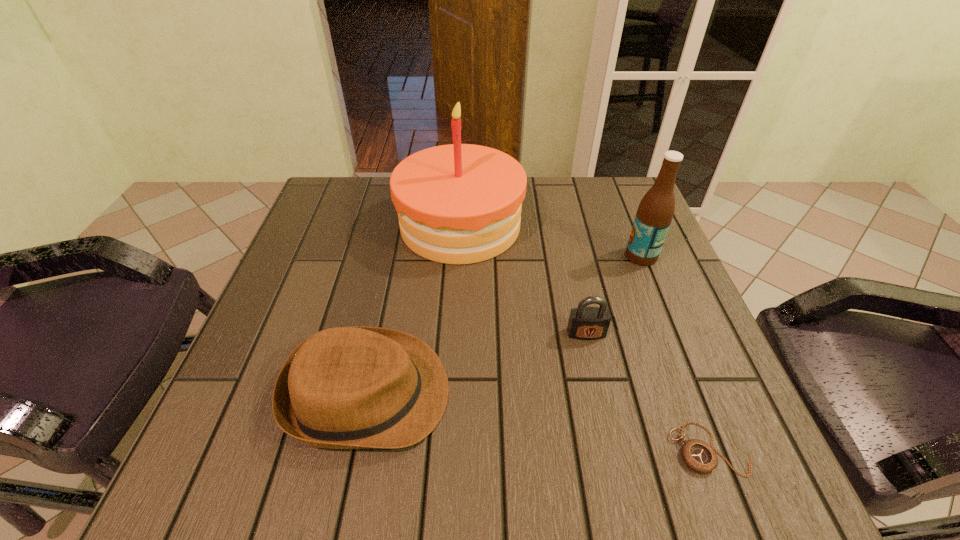
Identify the location of vacant area that lies between the tallest object and the fedora. The image size is (960, 540). pyautogui.click(x=414, y=309).

Where is `free space between the third object from left to right and the fedora`? free space between the third object from left to right and the fedora is located at coordinates (477, 363).

Where is `blank region between the second tallest object and the tallest object`? The width and height of the screenshot is (960, 540). blank region between the second tallest object and the tallest object is located at coordinates (551, 240).

Locate an element on the screen. The image size is (960, 540). vacant space that's between the birthday cake and the padlock is located at coordinates (523, 279).

Locate which object ranks fourth in proximity to the second tallest object. Please provide its 2D coordinates. Your answer should be formatted as a tuple, i.e. [(x, y)], where the tuple contains the x and y coordinates of a point satisfying the conditions above.

[(346, 387)]

Image resolution: width=960 pixels, height=540 pixels. Identify the location of object that is the closest to the fedora. (459, 203).

Image resolution: width=960 pixels, height=540 pixels. I want to click on free region that satisfies the following two spatial constraints: 1. on the front-facing side of the fedora; 2. on the back side of the pocket watch, so click(356, 449).

Where is `free space that satisfies the following two spatial constraints: 1. on the front-facing side of the fedora; 2. on the left side of the shortest object`? free space that satisfies the following two spatial constraints: 1. on the front-facing side of the fedora; 2. on the left side of the shortest object is located at coordinates (356, 449).

What are the coordinates of `vacant region that satisfies the following two spatial constraints: 1. on the front-facing side of the pocket watch; 2. on the left side of the fedora` in the screenshot? It's located at tap(356, 449).

Locate an element on the screen. This screenshot has height=540, width=960. vacant region that satisfies the following two spatial constraints: 1. on the front of the third object from left to right near the keyhole; 2. on the left side of the pocket watch is located at coordinates (612, 449).